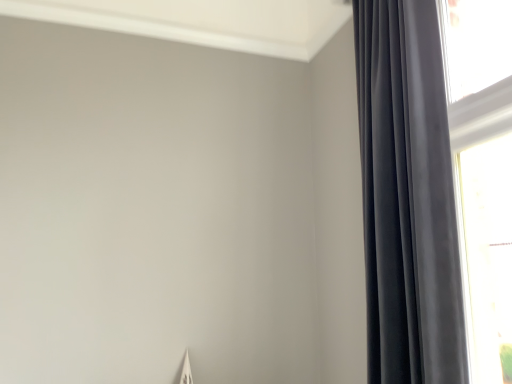
Question: From a real-world perspective, relative to transparent glass window at right, is satin black curtain at right vertically above or below?

Choices:
 (A) below
 (B) above

Answer: (B)

Question: Looking at the image, does satin black curtain at right seem bigger or smaller compared to transparent glass window at right?

Choices:
 (A) big
 (B) small

Answer: (A)

Question: Is satin black curtain at right wider or thinner than transparent glass window at right?

Choices:
 (A) thin
 (B) wide

Answer: (B)

Question: From the image's perspective, is transparent glass window at right located above or below satin black curtain at right?

Choices:
 (A) above
 (B) below

Answer: (B)

Question: In the image, is transparent glass window at right on the left side or the right side of satin black curtain at right?

Choices:
 (A) left
 (B) right

Answer: (B)

Question: Is transparent glass window at right wider or thinner than satin black curtain at right?

Choices:
 (A) wide
 (B) thin

Answer: (B)

Question: Would you say transparent glass window at right is inside or outside satin black curtain at right?

Choices:
 (A) inside
 (B) outside

Answer: (B)